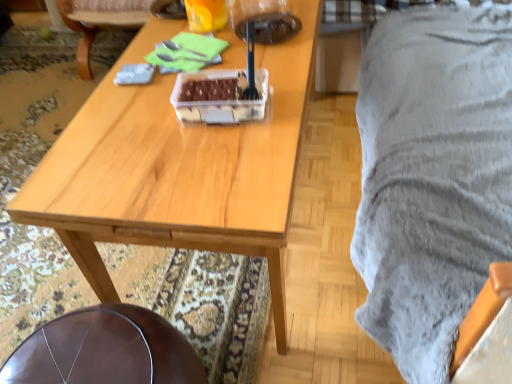
Identify the location of free point behind translucent plastic container at center. The image size is (512, 384). (260, 60).